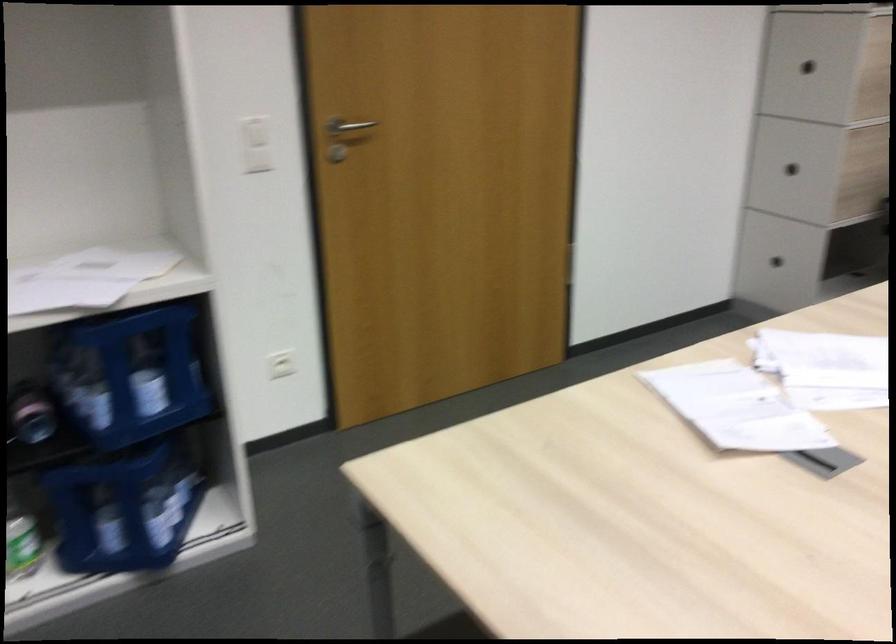
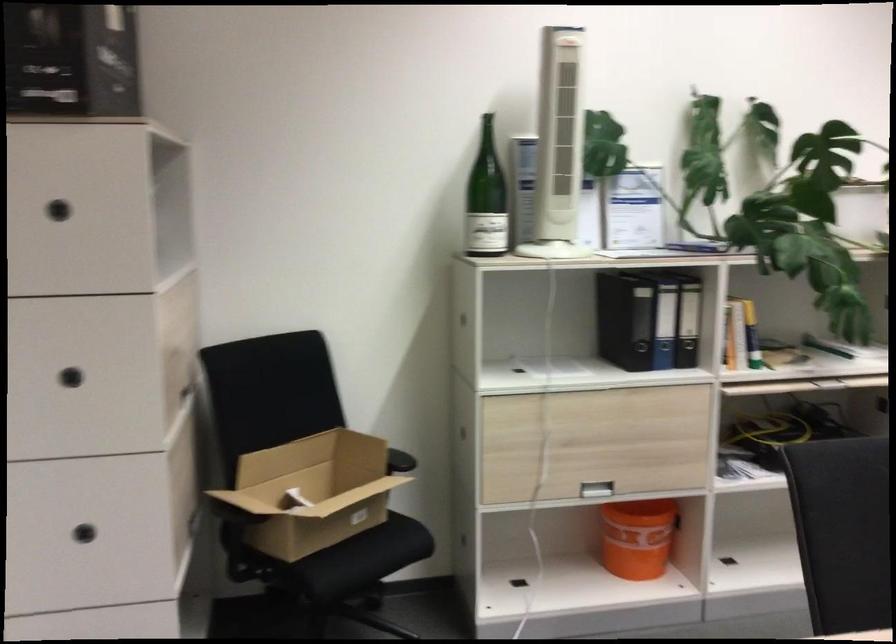
The point at (780, 185) is marked in the first image. Where is the corresponding point in the second image?

(85, 554)